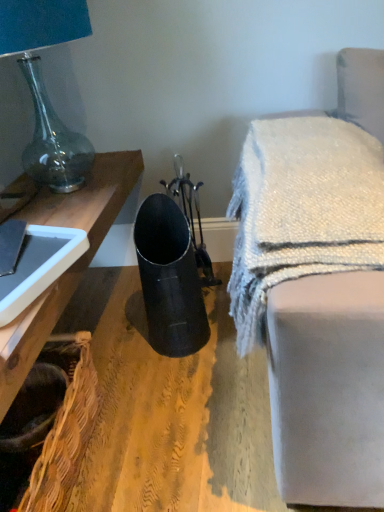
Question: Is white textured blanket at upper right not within teal glass lamp at upper left?

Choices:
 (A) yes
 (B) no

Answer: (A)

Question: Is white textured blanket at upper right bigger than teal glass lamp at upper left?

Choices:
 (A) no
 (B) yes

Answer: (A)

Question: Could you tell me if white textured blanket at upper right is turned towards teal glass lamp at upper left?

Choices:
 (A) no
 (B) yes

Answer: (A)

Question: Is the position of white textured blanket at upper right less distant than that of teal glass lamp at upper left?

Choices:
 (A) no
 (B) yes

Answer: (B)

Question: From a real-world perspective, is white textured blanket at upper right on teal glass lamp at upper left?

Choices:
 (A) no
 (B) yes

Answer: (A)

Question: Is white textured blanket at upper right to the left or to the right of teal glass lamp at upper left in the image?

Choices:
 (A) left
 (B) right

Answer: (B)

Question: Is white textured blanket at upper right situated inside teal glass lamp at upper left or outside?

Choices:
 (A) inside
 (B) outside

Answer: (B)

Question: Is white textured blanket at upper right in front of or behind teal glass lamp at upper left in the image?

Choices:
 (A) behind
 (B) front

Answer: (B)

Question: Considering the positions of white textured blanket at upper right and teal glass lamp at upper left in the image, is white textured blanket at upper right taller or shorter than teal glass lamp at upper left?

Choices:
 (A) tall
 (B) short

Answer: (B)

Question: Considering their positions, is teal glass lamp at upper left located in front of or behind white textured blanket at upper right?

Choices:
 (A) front
 (B) behind

Answer: (B)

Question: Considering the relative positions of teal glass lamp at upper left and white textured blanket at upper right in the image provided, is teal glass lamp at upper left to the left or to the right of white textured blanket at upper right?

Choices:
 (A) left
 (B) right

Answer: (A)

Question: Is point (66, 140) closer or farther from the camera than point (251, 302)?

Choices:
 (A) farther
 (B) closer

Answer: (A)

Question: Do you think teal glass lamp at upper left is within white textured blanket at upper right, or outside of it?

Choices:
 (A) inside
 (B) outside

Answer: (B)

Question: Is woven brown basket at lower left spatially inside white textured blanket at upper right, or outside of it?

Choices:
 (A) inside
 (B) outside

Answer: (B)

Question: From their relative heights in the image, would you say woven brown basket at lower left is taller or shorter than white textured blanket at upper right?

Choices:
 (A) tall
 (B) short

Answer: (B)